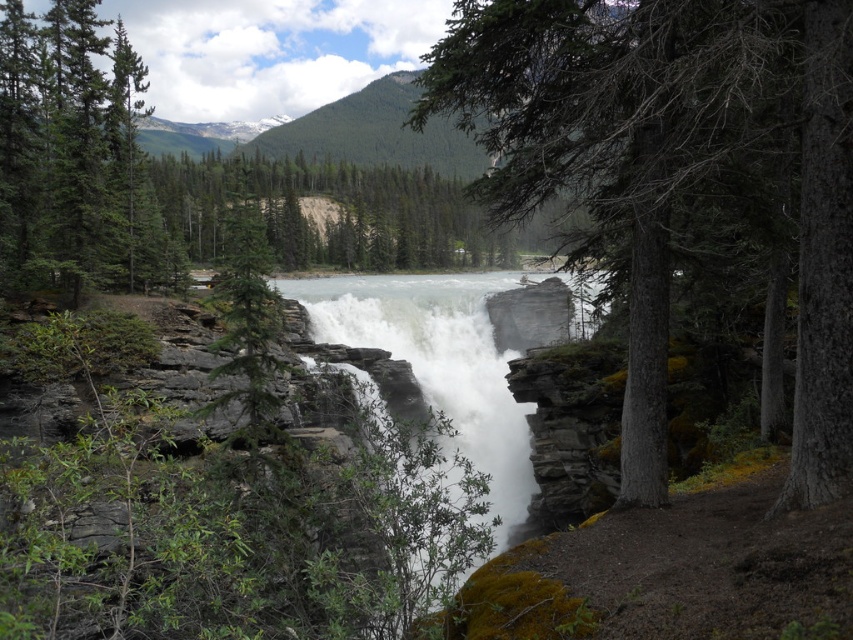
Does green rough bark tree at center have a larger size compared to green matte tree at upper left?

No, green rough bark tree at center is not bigger than green matte tree at upper left.

Can you confirm if green rough bark tree at center is wider than green matte tree at upper left?

No.

Between point (473, 61) and point (57, 118), which one is positioned behind?

Point (57, 118)

This screenshot has width=853, height=640. In order to click on green rough bark tree at center in this screenshot , I will do `click(672, 168)`.

Does green rough bark tree at center lie behind white frothy water at center?

That is False.

Identify the location of green rough bark tree at center. (672, 168).

Measure the distance between green rough bark tree at center and camera.

8.21 meters

Image resolution: width=853 pixels, height=640 pixels. What are the coordinates of `green rough bark tree at center` in the screenshot? It's located at (672, 168).

How much distance is there between green matte tree at upper left and white frothy water at center?

green matte tree at upper left is 23.02 meters away from white frothy water at center.

Which is more to the right, green matte tree at upper left or white frothy water at center?

white frothy water at center is more to the right.

Describe the element at coordinates (74, 157) in the screenshot. The width and height of the screenshot is (853, 640). I see `green matte tree at upper left` at that location.

The width and height of the screenshot is (853, 640). Find the location of `green matte tree at upper left`. green matte tree at upper left is located at coordinates (74, 157).